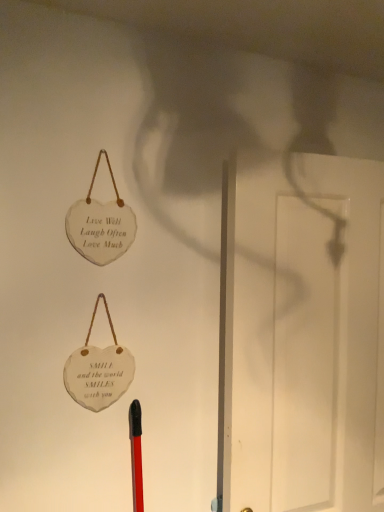
Identify the location of white wood screen door at right. (305, 332).

Describe the element at coordinates (305, 332) in the screenshot. The height and width of the screenshot is (512, 384). I see `white wood screen door at right` at that location.

Find the location of a particular element. This screenshot has height=512, width=384. white wood screen door at right is located at coordinates (305, 332).